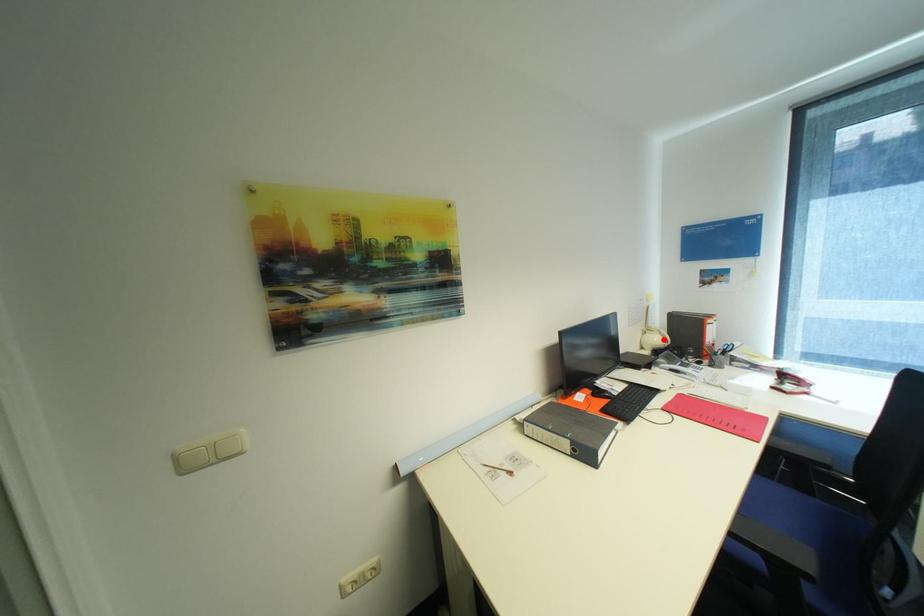
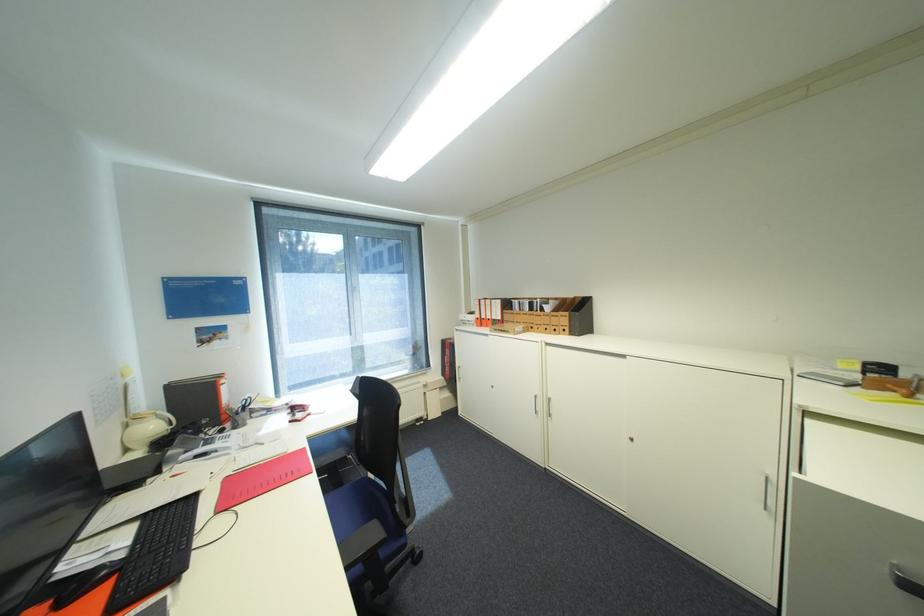
Find the pixel in the second image that matches the highlighted location in the first image.

(161, 427)